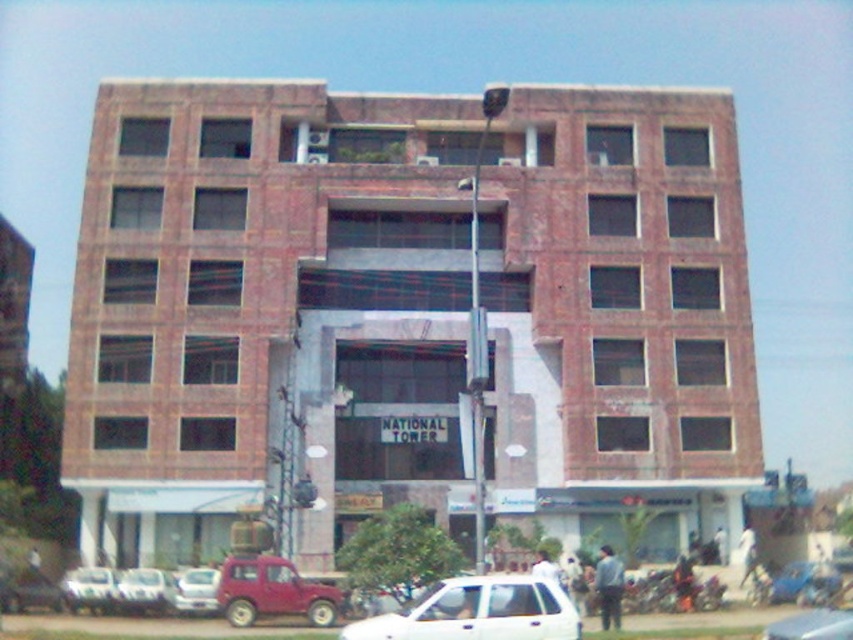
Question: Observing the image, what is the correct spatial positioning of white matte car at lower left in reference to metallic silver car at lower left?

Choices:
 (A) left
 (B) right

Answer: (A)

Question: Among these points, which one is farthest from the camera?

Choices:
 (A) (219, 572)
 (B) (144, 595)
 (C) (547, 632)

Answer: (A)

Question: Is white matte car at lower center closer to camera compared to silver metallic car at lower left?

Choices:
 (A) yes
 (B) no

Answer: (A)

Question: Which object is positioned farthest from the white matte car at lower left?

Choices:
 (A) silver metallic car at lower left
 (B) white matte car at lower center
 (C) metallic silver car at lower left

Answer: (B)

Question: Which point is farther to the camera?

Choices:
 (A) (218, 577)
 (B) (74, 600)
 (C) (126, 588)
 (D) (810, 630)

Answer: (A)

Question: Is metallic silver car at center to the left of metallic silver car at lower left from the viewer's perspective?

Choices:
 (A) no
 (B) yes

Answer: (A)